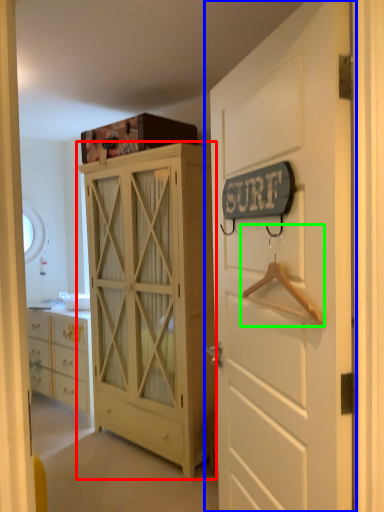
Question: Which is farther away from cabinetry (highlighted by a red box)? door (highlighted by a blue box) or hanger (highlighted by a green box)?

Choices:
 (A) door
 (B) hanger

Answer: (B)